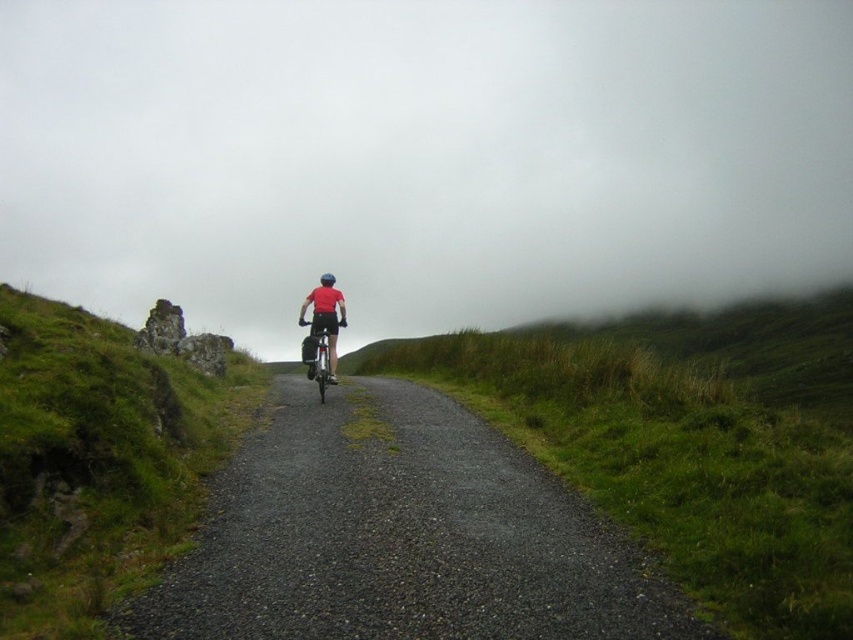
Question: Which of these objects is positioned farthest from the shiny metallic bicycle at center?

Choices:
 (A) gravel road at center
 (B) white foggy cloud at upper center
 (C) green grassy hillside at left

Answer: (B)

Question: Is white foggy cloud at upper center smaller than shiny metallic bicycle at center?

Choices:
 (A) no
 (B) yes

Answer: (A)

Question: Is white foggy cloud at upper center smaller than green grassy hillside at left?

Choices:
 (A) yes
 (B) no

Answer: (B)

Question: Among these points, which one is farthest from the camera?

Choices:
 (A) (302, 358)
 (B) (642, 307)
 (C) (221, 547)

Answer: (B)

Question: Estimate the real-world distances between objects in this image. Which object is farther from the shiny metallic bicycle at center?

Choices:
 (A) white foggy cloud at upper center
 (B) gravel road at center
 (C) green grassy hillside at left

Answer: (A)

Question: Observing the image, what is the correct spatial positioning of green grassy hillside at left in reference to shiny metallic bicycle at center?

Choices:
 (A) left
 (B) right

Answer: (A)